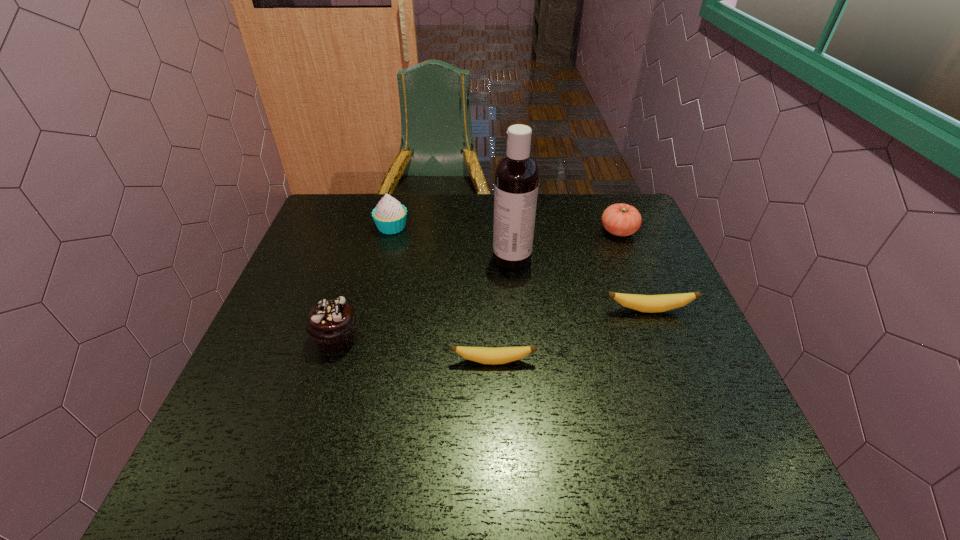
You are a GUI agent. You are given a task and a screenshot of the screen. Output one action in this format:
    pyautogui.click(x=<x>, y=<y>)
    Task: Click on the banana at the right edge
    
    Given the screenshot: What is the action you would take?
    pyautogui.click(x=644, y=303)

The image size is (960, 540). What are the coordinates of `tomato at the right edge` in the screenshot? It's located at (621, 219).

Where is `object located at the far right corner`? The width and height of the screenshot is (960, 540). object located at the far right corner is located at coordinates (621, 219).

Locate an element on the screen. The width and height of the screenshot is (960, 540). free space at the far edge of the desktop is located at coordinates (413, 232).

Where is `blank space at the near edge`? Image resolution: width=960 pixels, height=540 pixels. blank space at the near edge is located at coordinates (497, 433).

Locate an element on the screen. The width and height of the screenshot is (960, 540). vacant space at the left edge of the desktop is located at coordinates (327, 265).

In the image, there is a desktop. At what (x,y) coordinates should I click in order to perform the action: click on free region at the right edge. Please return your answer as a coordinate pair (x, y). Looking at the image, I should click on (644, 295).

At what (x,y) coordinates should I click in order to perform the action: click on vacant space at the far left corner of the desktop. Please return your answer as a coordinate pair (x, y). Looking at the image, I should click on (340, 224).

At what (x,y) coordinates should I click in order to perform the action: click on free space at the near left corner of the desktop. Please return your answer as a coordinate pair (x, y). The width and height of the screenshot is (960, 540). Looking at the image, I should click on (273, 400).

The height and width of the screenshot is (540, 960). In the image, there is a desktop. In order to click on vacant area at the far right corner in this screenshot , I will do `click(643, 229)`.